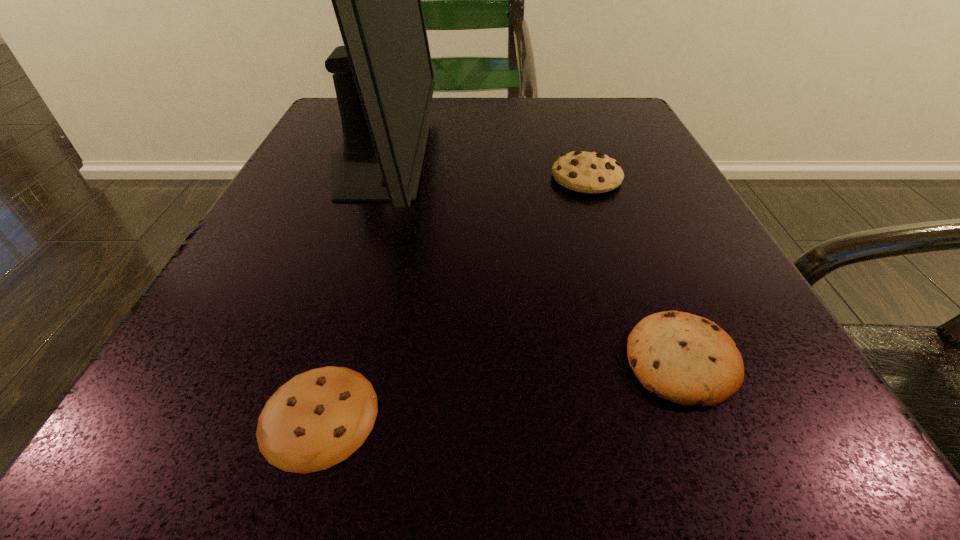
The height and width of the screenshot is (540, 960). Identify the location of computer monitor. (383, 76).

Where is `the second tallest object`? the second tallest object is located at coordinates (587, 172).

Where is `the farthest cookie`? The width and height of the screenshot is (960, 540). the farthest cookie is located at coordinates (587, 172).

Where is `the second tallest cookie`? The image size is (960, 540). the second tallest cookie is located at coordinates (687, 359).

You are a GUI agent. You are given a task and a screenshot of the screen. Output one action in this format:
    pyautogui.click(x=<x>, y=<y>)
    Task: Click on the shortest cookie
    
    Given the screenshot: What is the action you would take?
    coord(317,419)

Identify the location of the leftmost cookie. (317, 419).

At what (x,y) coordinates should I click in order to perform the action: click on free space located on the screen side of the tallest object. Please return your answer as a coordinate pair (x, y). The height and width of the screenshot is (540, 960). Looking at the image, I should click on (585, 158).

At what (x,y) coordinates should I click in order to perform the action: click on vacant region located on the front of the farthest cookie. Please return your answer as a coordinate pair (x, y). Looking at the image, I should click on (650, 364).

Where is `blank space located on the left of the second shortest object`? This screenshot has height=540, width=960. blank space located on the left of the second shortest object is located at coordinates (380, 360).

Where is `blank space located on the left of the shortest cookie`? The height and width of the screenshot is (540, 960). blank space located on the left of the shortest cookie is located at coordinates (156, 415).